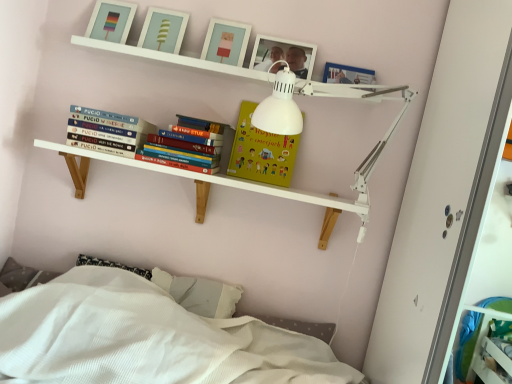
Question: Based on their positions, is wooden picture frame at upper center, which ranks as the fifth picture frame in left-to-right order, located to the left or right of matte white picture frame at upper center, the 3th picture frame from the right?

Choices:
 (A) left
 (B) right

Answer: (B)

Question: In the image, is wooden picture frame at upper center, which ranks as the fifth picture frame in left-to-right order, positioned in front of or behind matte white picture frame at upper center, the 3th picture frame from the right?

Choices:
 (A) behind
 (B) front

Answer: (B)

Question: Which object is the closest to the white plastic lamp at upper center?

Choices:
 (A) blue hardcover book at left
 (B) matte plastic picture frame at upper center, the fifth picture frame in the right-to-left sequence
 (C) wooden picture frame at upper center, placed as the 2th picture frame when sorted from right to left
 (D) white matte shelf at upper center, marked as the 2th shelf in a bottom-to-top arrangement
 (E) matte white picture frame at upper center, marked as the 2th picture frame in a left-to-right arrangement

Answer: (D)

Question: Estimate the real-world distances between objects in this image. Which object is closer to the matte white picture frame at upper center, the 3th picture frame from the right?

Choices:
 (A) white wooden shelf at upper center, which is counted as the second shelf, starting from the top
 (B) matte white picture frame at upper center, the fourth picture frame viewed from the right
 (C) matte plastic picture frame at upper center, the fifth picture frame in the right-to-left sequence
 (D) white plastic lamp at upper center
 (E) white matte shelf at upper center, acting as the first shelf starting from the top

Answer: (B)